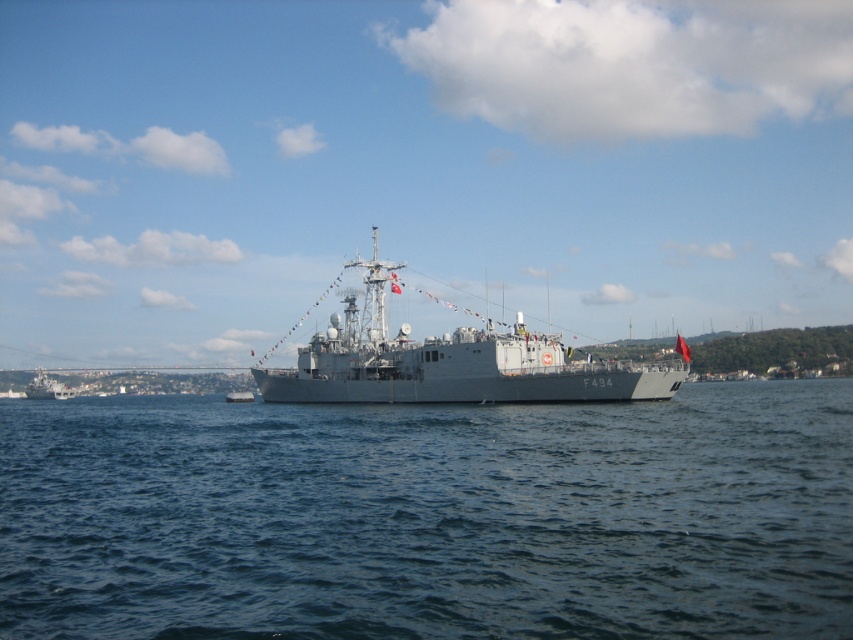
Question: Is blue water at center smaller than gray metallic ship at center?

Choices:
 (A) yes
 (B) no

Answer: (A)

Question: Which point is farther to the camera?

Choices:
 (A) blue water at center
 (B) gray metallic ship at center
 (C) gray metallic ship at left

Answer: (C)

Question: Estimate the real-world distances between objects in this image. Which object is closer to the gray metallic ship at left?

Choices:
 (A) blue water at center
 (B) gray metallic ship at center

Answer: (B)

Question: Is blue water at center further to camera compared to gray metallic ship at center?

Choices:
 (A) no
 (B) yes

Answer: (A)

Question: Which point is closer to the camera taking this photo?

Choices:
 (A) (53, 381)
 (B) (320, 337)

Answer: (B)

Question: Does blue water at center appear over gray metallic ship at center?

Choices:
 (A) yes
 (B) no

Answer: (B)